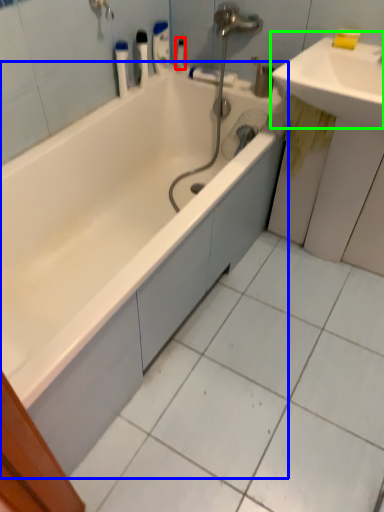
Question: Which object is positioned closest to toiletry (highlighted by a red box)? Select from bathtub (highlighted by a blue box) and sink (highlighted by a green box).

Choices:
 (A) bathtub
 (B) sink

Answer: (B)